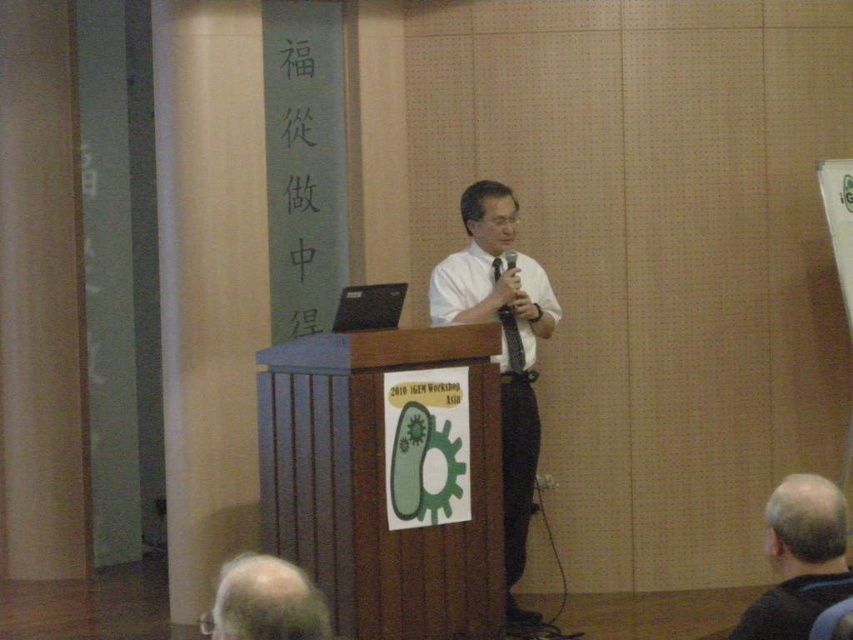
Question: Can you confirm if white glossy shirt at center is wider than gray hair at lower left?

Choices:
 (A) no
 (B) yes

Answer: (B)

Question: Which of the following is the closest to the observer?

Choices:
 (A) (509, 257)
 (B) (850, 579)
 (C) (444, 278)

Answer: (B)

Question: Which of the following is the farthest from the observer?

Choices:
 (A) (503, 205)
 (B) (808, 570)
 (C) (511, 257)

Answer: (A)

Question: Which point is farther to the camera?

Choices:
 (A) white glossy shirt at center
 (B) gray hair at lower left
 (C) black fabric microphone at center

Answer: (C)

Question: Is gray hair at lower left wider than white smooth dress shirt at center?

Choices:
 (A) yes
 (B) no

Answer: (B)

Question: Can you confirm if gray hair at lower left is positioned above black fabric microphone at center?

Choices:
 (A) yes
 (B) no

Answer: (B)